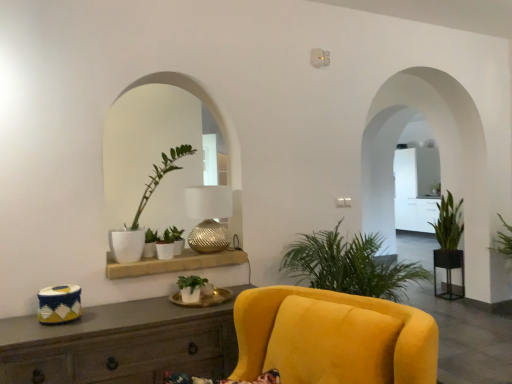
From the picture: Measure the distance between green leafy plant at right, positioned as the 1th houseplant in right-to-left order, and camera.

green leafy plant at right, positioned as the 1th houseplant in right-to-left order, and camera are 3.96 meters apart.

Describe the element at coordinates (204, 298) in the screenshot. This screenshot has height=384, width=512. I see `white ceramic round table at center, marked as the 2th round table in a bottom-to-top arrangement` at that location.

What is the approximate height of white ceramic round table at center, marked as the 2th round table in a bottom-to-top arrangement?

0.98 inches.

Find the location of `matte white pot at center, the 2th houseplant viewed from the left`. matte white pot at center, the 2th houseplant viewed from the left is located at coordinates (143, 210).

Describe the element at coordinates (191, 288) in the screenshot. The image size is (512, 384). I see `green matte plant at center, placed as the 4th houseplant when sorted from left to right` at that location.

Image resolution: width=512 pixels, height=384 pixels. Identify the location of metallic round table at right, which is the first round table in back-to-front order. (448, 270).

From the image's perspective, who appears lower, matte white pot at center, which is the 5th houseplant from back to front, or metallic round table at right, which is the first round table in back-to-front order?

metallic round table at right, which is the first round table in back-to-front order, appears lower in the image.

Between matte white pot at center, marked as the second houseplant in a front-to-back arrangement, and metallic round table at right, which ranks as the 1th round table in bottom-to-top order, which one is positioned in front?

matte white pot at center, marked as the second houseplant in a front-to-back arrangement.

Is matte white pot at center, the 5th houseplant from the right, not inside metallic round table at right, positioned as the first round table in right-to-left order?

Indeed, matte white pot at center, the 5th houseplant from the right, is completely outside metallic round table at right, positioned as the first round table in right-to-left order.

Is matte white pot at center, marked as the second houseplant in a front-to-back arrangement, wider than metallic round table at right, the 2th round table in the front-to-back sequence?

Yes, matte white pot at center, marked as the second houseplant in a front-to-back arrangement, is wider than metallic round table at right, the 2th round table in the front-to-back sequence.

Does matte white pot at center, the 2th houseplant viewed from the left, lie in front of metallic textured lamp at center?

Yes, it is.

Between matte white pot at center, which is the 5th houseplant from back to front, and metallic textured lamp at center, which one appears on the left side from the viewer's perspective?

Positioned to the left is matte white pot at center, which is the 5th houseplant from back to front.

Locate an element on the screen. The width and height of the screenshot is (512, 384). lamp that is behind the matte white pot at center, the 2th houseplant viewed from the left is located at coordinates (208, 217).

Locate an element on the screen. lamp located above the wooden cabinet at lower left (from the image's perspective) is located at coordinates (208, 217).

Based on their positions, is metallic textured lamp at center located to the left or right of wooden cabinet at lower left?

In the image, metallic textured lamp at center appears on the right side of wooden cabinet at lower left.

Which object is wider, metallic textured lamp at center or wooden cabinet at lower left?

Wider between the two is wooden cabinet at lower left.

From the image's perspective, is metallic textured lamp at center above or below wooden cabinet at lower left?

Clearly, from the image's perspective, metallic textured lamp at center is above wooden cabinet at lower left.

Who is taller, green leafy plant at right, acting as the fifth houseplant starting from the front, or green matte plant at center, the 3th houseplant viewed from the front?

Standing taller between the two is green leafy plant at right, acting as the fifth houseplant starting from the front.

Does green leafy plant at right, the sixth houseplant viewed from the left, turn towards green matte plant at center, which ranks as the third houseplant in left-to-right order?

Yes, green leafy plant at right, the sixth houseplant viewed from the left, is turned towards green matte plant at center, which ranks as the third houseplant in left-to-right order.

Is green leafy plant at right, positioned as the 1th houseplant in right-to-left order, not near green matte plant at center, positioned as the 4th houseplant in right-to-left order?

green leafy plant at right, positioned as the 1th houseplant in right-to-left order, is positioned a significant distance from green matte plant at center, positioned as the 4th houseplant in right-to-left order.

From the image's perspective, which is below, green leafy plant at right, positioned as the 1th houseplant in right-to-left order, or green matte plant at center, which ranks as the third houseplant in left-to-right order?

From the image's view, green leafy plant at right, positioned as the 1th houseplant in right-to-left order, is below.

Considering the sizes of objects green matte plant at center, which appears as the first houseplant when viewed from the left, and green leafy plant at right, which ranks as the sixth houseplant in front-to-back order, in the image provided, who is taller, green matte plant at center, which appears as the first houseplant when viewed from the left, or green leafy plant at right, which ranks as the sixth houseplant in front-to-back order,?

Standing taller between the two is green leafy plant at right, which ranks as the sixth houseplant in front-to-back order.

Is green matte plant at center, the sixth houseplant when ordered from right to left, positioned with its back to green leafy plant at right, which ranks as the sixth houseplant in front-to-back order?

That's not correct — green matte plant at center, the sixth houseplant when ordered from right to left, is not looking away from green leafy plant at right, which ranks as the sixth houseplant in front-to-back order.

From a real-world perspective, is green matte plant at center, the sixth houseplant when ordered from right to left, physically above green leafy plant at right, placed as the fifth houseplant when sorted from left to right?

Correct, in the physical world, green matte plant at center, the sixth houseplant when ordered from right to left, is higher than green leafy plant at right, placed as the fifth houseplant when sorted from left to right.

Based on the photo, measure the distance from green matte plant at center, the sixth houseplant when ordered from right to left, to green leafy plant at right, which ranks as the first houseplant in back-to-front order.

green matte plant at center, the sixth houseplant when ordered from right to left, and green leafy plant at right, which ranks as the first houseplant in back-to-front order, are 10.43 feet apart from each other.

Is green matte plant at center, arranged as the sixth houseplant when viewed from the back, facing towards green matte plant at center, the sixth houseplant when ordered from right to left?

No, green matte plant at center, arranged as the sixth houseplant when viewed from the back, is not aimed at green matte plant at center, the sixth houseplant when ordered from right to left.

Which is in front, point (193, 276) or point (147, 244)?

The point (193, 276) is in front.

How many degrees apart are the facing directions of green matte plant at center, which is the 3th houseplant in right-to-left order, and green matte plant at center, the sixth houseplant when ordered from right to left?

They differ by 1.89 degrees in their facing directions.

Is green matte plant at center, placed as the 4th houseplant when sorted from left to right, far away from green matte plant at center, which appears as the first houseplant when viewed from the left?

That's not correct — green matte plant at center, placed as the 4th houseplant when sorted from left to right, is a little close to green matte plant at center, which appears as the first houseplant when viewed from the left.

Who is shorter, green matte plant at center, placed as the 4th houseplant when sorted from left to right, or green matte plant at center, positioned as the 4th houseplant in right-to-left order?

green matte plant at center, placed as the 4th houseplant when sorted from left to right, is shorter.

Considering the relative positions of green matte plant at center, arranged as the sixth houseplant when viewed from the back, and green matte plant at center, which is the fourth houseplant from back to front, in the image provided, is green matte plant at center, arranged as the sixth houseplant when viewed from the back, behind green matte plant at center, which is the fourth houseplant from back to front,?

No.

From a real-world perspective, is green matte plant at center, the first houseplant in the front-to-back sequence, physically located above or below green matte plant at center, positioned as the 4th houseplant in right-to-left order?

green matte plant at center, the first houseplant in the front-to-back sequence, is situated lower than green matte plant at center, positioned as the 4th houseplant in right-to-left order, in the real world.

The height and width of the screenshot is (384, 512). There is a green matte plant at center, positioned as the 4th houseplant in right-to-left order. Identify the location of the 2nd houseplant below it (from the image's perspective). (191, 288).

Where is `the 2nd round table counting from the right of the matte white pot at center, the 2th houseplant viewed from the left`? Image resolution: width=512 pixels, height=384 pixels. the 2nd round table counting from the right of the matte white pot at center, the 2th houseplant viewed from the left is located at coordinates (448, 270).

Image resolution: width=512 pixels, height=384 pixels. In order to click on lamp below the matte white pot at center, marked as the second houseplant in a front-to-back arrangement (from the image's perspective) in this screenshot , I will do `click(208, 217)`.

Based on their spatial positions, is metallic textured lamp at center or metallic round table at right, which is the 2th round table from top to bottom, further from matte white pot at center, marked as the second houseplant in a front-to-back arrangement?

Among the two, metallic round table at right, which is the 2th round table from top to bottom, is located further to matte white pot at center, marked as the second houseplant in a front-to-back arrangement.

Based on the photo, based on their spatial positions, is green matte plant at center, which appears as the first houseplant when viewed from the left, or matte white pot at center, which is the 5th houseplant from back to front, further from white ceramic round table at center, which ranks as the second round table in right-to-left order?

A: matte white pot at center, which is the 5th houseplant from back to front, is further to white ceramic round table at center, which ranks as the second round table in right-to-left order.

From the image, which object appears to be farther from green matte plant at center, the sixth houseplant when ordered from right to left, green leafy plant at right, which ranks as the first houseplant in back-to-front order, or white ceramic round table at center, which ranks as the second round table in right-to-left order?

green leafy plant at right, which ranks as the first houseplant in back-to-front order, is further to green matte plant at center, the sixth houseplant when ordered from right to left.

Estimate the real-world distances between objects in this image. Which object is closer to green leafy plant at right, which ranks as the first houseplant in back-to-front order, green matte plant at center, which is the third houseplant in back-to-front order, or matte white shelf at center?

matte white shelf at center is positioned closer to the anchor green leafy plant at right, which ranks as the first houseplant in back-to-front order.

Estimate the real-world distances between objects in this image. Which object is closer to green matte plant at center, which is the 3th houseplant in right-to-left order, green leafy plant at right, which is counted as the second houseplant, starting from the back, or white ceramic round table at center, which is the 1th round table from top to bottom?

white ceramic round table at center, which is the 1th round table from top to bottom, is positioned closer to the anchor green matte plant at center, which is the 3th houseplant in right-to-left order.

Considering their positions, is green matte plant at center, the first houseplant in the front-to-back sequence, positioned further to metallic textured lamp at center than green matte plant at center, the 3th houseplant viewed from the front?

green matte plant at center, the first houseplant in the front-to-back sequence, is positioned further to the anchor metallic textured lamp at center.

Which object lies further to the anchor point green leafy plant at right, positioned as the 1th houseplant in right-to-left order, wooden cabinet at lower left or matte white shelf at center?

wooden cabinet at lower left is positioned further to the anchor green leafy plant at right, positioned as the 1th houseplant in right-to-left order.

Which object lies further to the anchor point white ceramic round table at center, the 1th round table when ordered from front to back, green matte plant at center, positioned as the fourth houseplant in front-to-back order, or green matte plant at center, which is the fourth houseplant from back to front?

green matte plant at center, positioned as the fourth houseplant in front-to-back order, lies further to white ceramic round table at center, the 1th round table when ordered from front to back, than the other object.

Identify the location of shelf between wooden cabinet at lower left and metallic round table at right, which is the 2th round table from top to bottom, from left to right. This screenshot has width=512, height=384. (174, 263).

At what (x,y) coordinates should I click in order to perform the action: click on lamp between green matte plant at center, which ranks as the third houseplant in left-to-right order, and green leafy plant at right, positioned as the 1th houseplant in right-to-left order, from left to right. Please return your answer as a coordinate pair (x, y). The width and height of the screenshot is (512, 384). Looking at the image, I should click on (208, 217).

You are a GUI agent. You are given a task and a screenshot of the screen. Output one action in this format:
    pyautogui.click(x=<x>, y=<y>)
    Task: Click on the lamp situated between matte white shelf at center and green leafy plant at right, placed as the 2th houseplant when sorted from right to left, from left to right
    
    Given the screenshot: What is the action you would take?
    pyautogui.click(x=208, y=217)

Where is `round table situated between green matte plant at center, which is the third houseplant in back-to-front order, and metallic round table at right, which ranks as the 1th round table in bottom-to-top order, from left to right`? The image size is (512, 384). round table situated between green matte plant at center, which is the third houseplant in back-to-front order, and metallic round table at right, which ranks as the 1th round table in bottom-to-top order, from left to right is located at coordinates (204, 298).